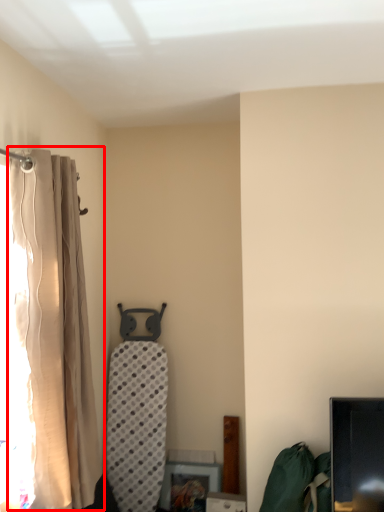
Question: In this image, where is curtain (annotated by the red box) located relative to bean bag chair?

Choices:
 (A) right
 (B) left

Answer: (B)